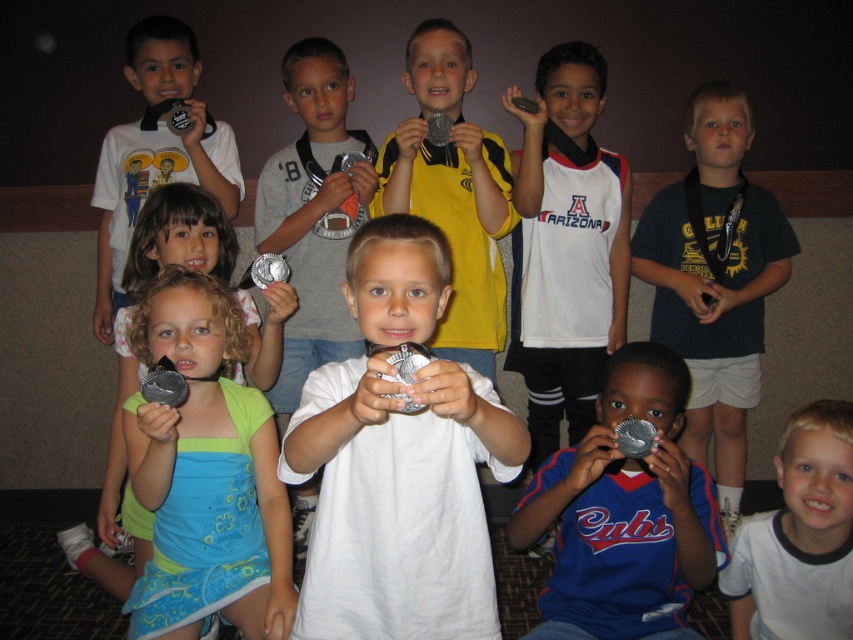
Question: Which point is closer to the camera taking this photo?

Choices:
 (A) (811, 417)
 (B) (155, 288)

Answer: (A)

Question: Among these objects, which one is nearest to the camera?

Choices:
 (A) metallic silver medal at center
 (B) white cotton shirt at lower right

Answer: (B)

Question: Is matte silver medal at lower left to the left of dark blue t-shirt at center from the viewer's perspective?

Choices:
 (A) no
 (B) yes

Answer: (B)

Question: Where is dark blue t-shirt at center located in relation to metallic silver medal at center in the image?

Choices:
 (A) below
 (B) above

Answer: (A)

Question: Which point is farther from the camera taking this photo?

Choices:
 (A) (695, 269)
 (B) (416, 61)
 (C) (223, 468)
 (D) (746, 566)

Answer: (A)

Question: Can you confirm if matte silver medal at lower left is positioned to the left of dark blue t-shirt at center?

Choices:
 (A) yes
 (B) no

Answer: (A)